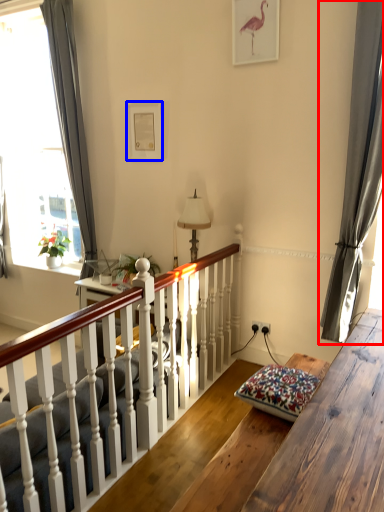
Question: Which of the following is the closest to the observer, curtain (highlighted by a red box) or picture frame (highlighted by a blue box)?

Choices:
 (A) curtain
 (B) picture frame

Answer: (A)